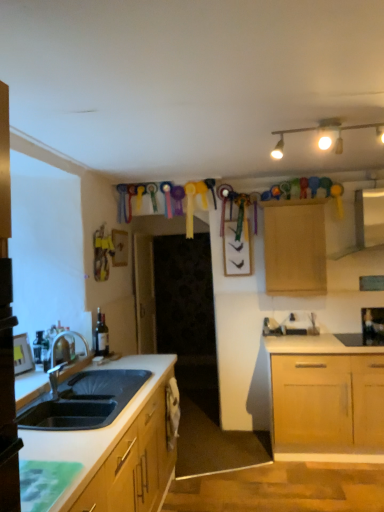
Find the location of a particular element. empty space that is ontop of matte gold track lights at upper center (from a real-world perspective) is located at coordinates (316, 121).